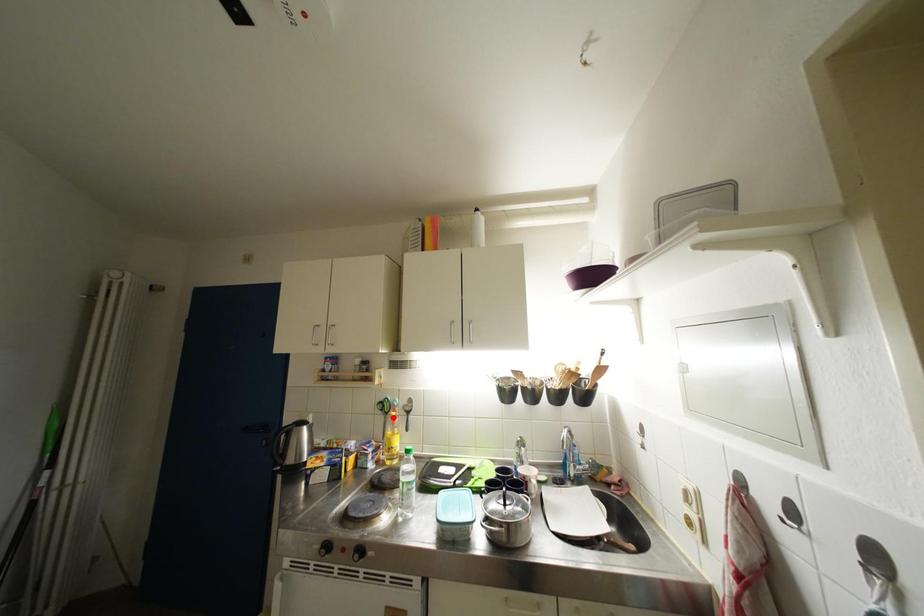
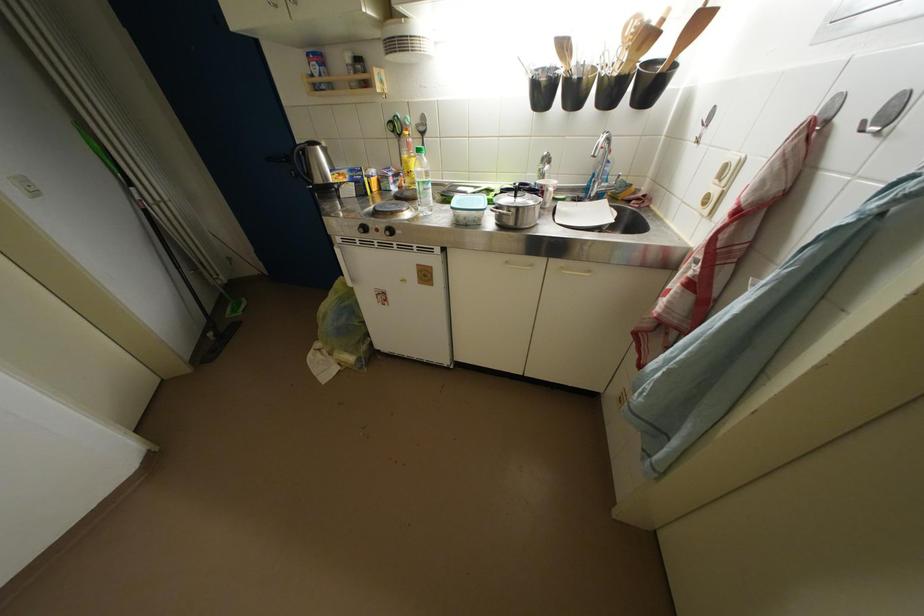
Question: I am providing you with two images of the same scene from different viewpoints. Given a red point in image1, look at the same physical point in image2. Is it:

Choices:
 (A) Closer to the viewpoint
 (B) Farther from the viewpoint

Answer: (A)